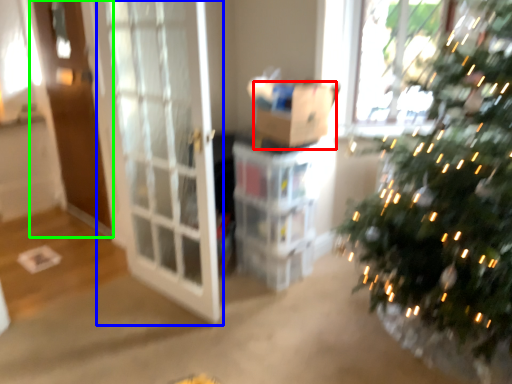
Question: Based on their relative distances, which object is nearer to cardboard box (highlighted by a red box)? Choose from screen door (highlighted by a blue box) and screen door (highlighted by a green box).

Choices:
 (A) screen door
 (B) screen door

Answer: (A)